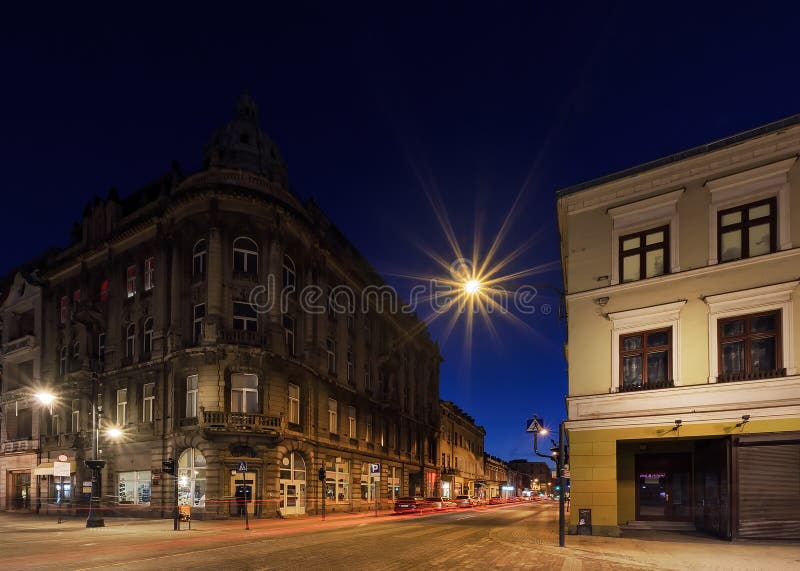
At what (x,y) coordinates should I click in order to perform the action: click on brown wood windows. Please return your answer as a coordinate pair (x, y). The image size is (800, 571). Looking at the image, I should click on (646, 371).